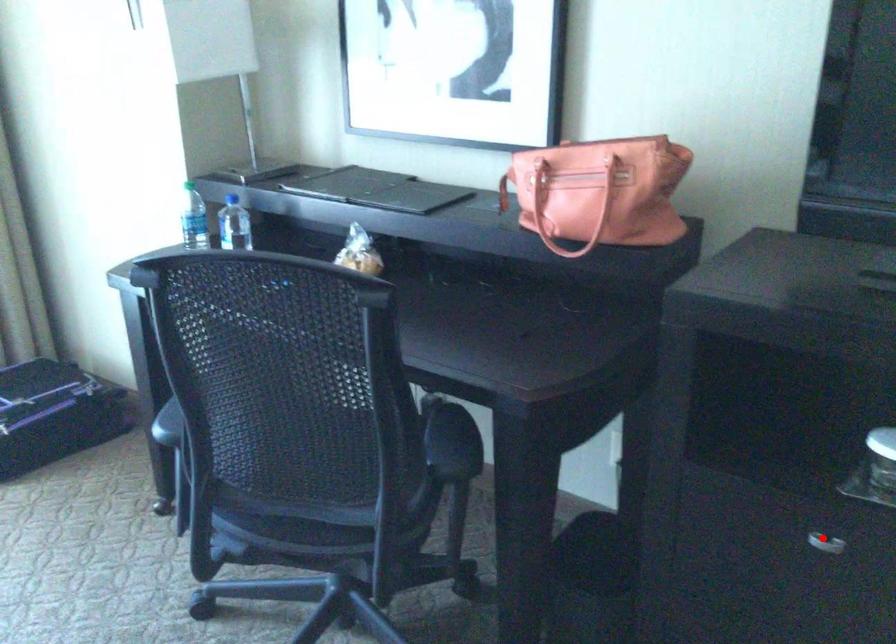
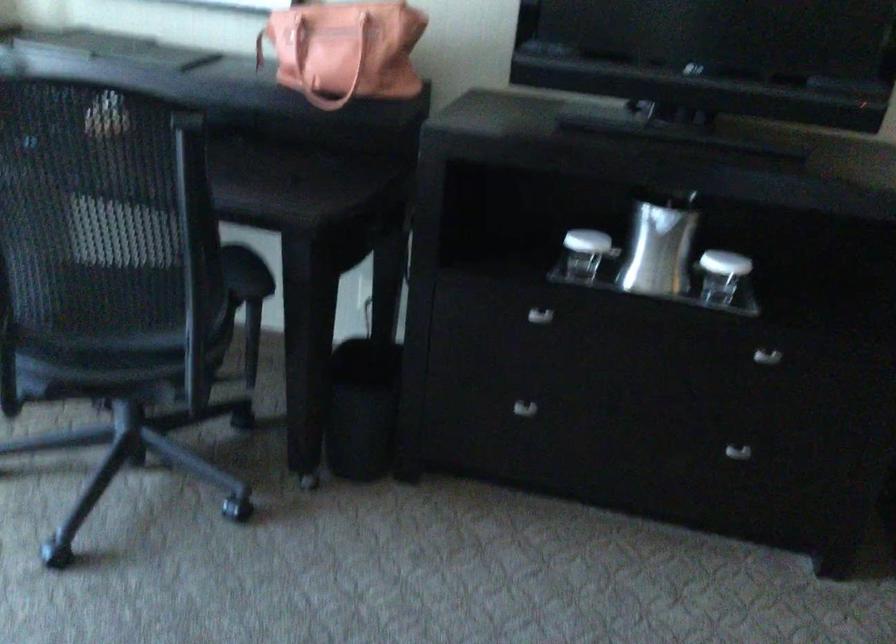
Where in the second image is the point corresponding to the highlighted location from the first image?

(539, 316)